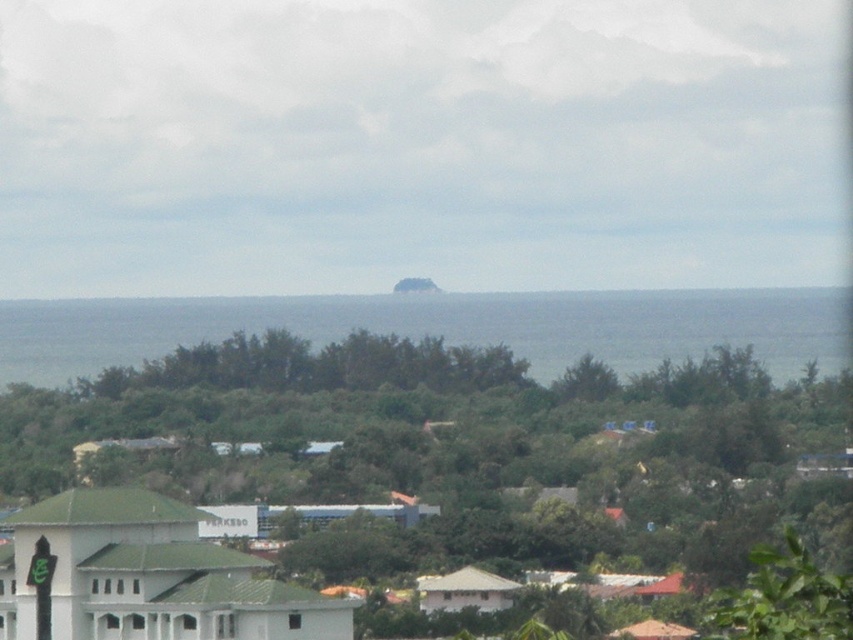
Question: Which object is closer to the camera taking this photo?

Choices:
 (A) green leafy tree at center
 (B) green leafy tree at lower right
 (C) gray/smooth water at center

Answer: (B)

Question: Is green leafy tree at center smaller than gray/smooth water at center?

Choices:
 (A) yes
 (B) no

Answer: (B)

Question: Which object is farther from the camera taking this photo?

Choices:
 (A) green leafy tree at center
 (B) gray/smooth water at center
 (C) green leafy tree at lower right

Answer: (B)

Question: Which object is farther from the camera taking this photo?

Choices:
 (A) green leafy tree at center
 (B) green leafy tree at lower right

Answer: (A)

Question: Observing the image, what is the correct spatial positioning of green leafy tree at center in reference to green leafy tree at lower right?

Choices:
 (A) right
 (B) left

Answer: (B)

Question: Does green leafy tree at center have a greater width compared to gray/smooth water at center?

Choices:
 (A) yes
 (B) no

Answer: (B)